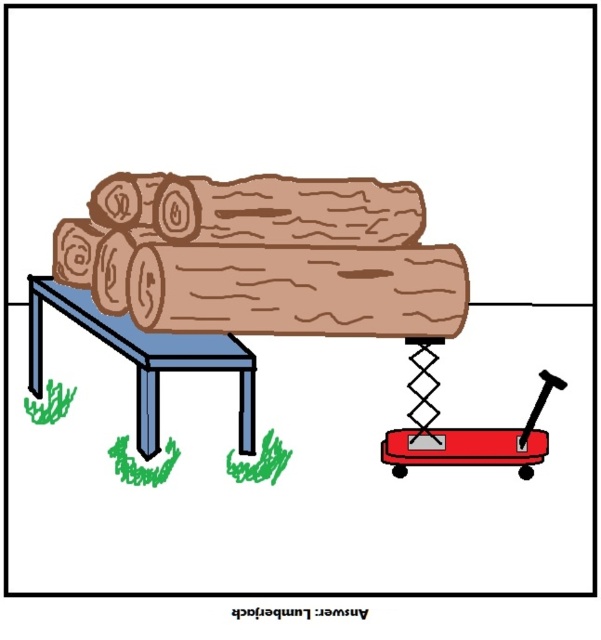
You are a worker who needs to move the blue metal table at lower left and the red plastic wagon at lower right closer together. The minimum distance required between them for the task is 3 inches. Based on the current distance, can you proceed with the task?

The blue metal table at lower left is currently 4.22 inches away from the red plastic wagon at lower right. Since 4.22 inches is greater than the required 3 inches minimum distance, you can proceed with the task as the distance is sufficient.